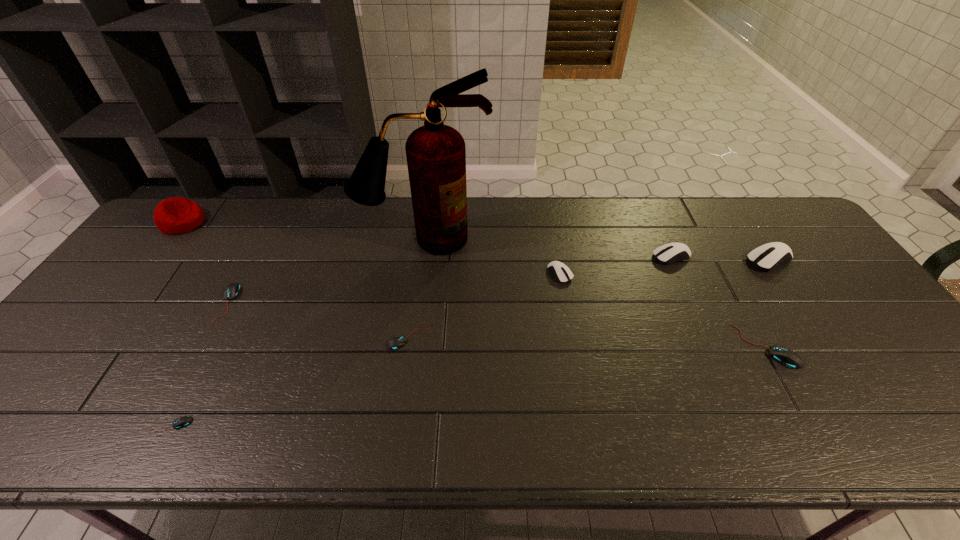
You are a GUI agent. You are given a task and a screenshot of the screen. Output one action in this format:
    pyautogui.click(x=<x>, y=<y>)
    Task: Click on the object at the left edge
    This screenshot has width=960, height=540.
    Given the screenshot: What is the action you would take?
    pyautogui.click(x=176, y=215)

You are a GUI agent. You are given a task and a screenshot of the screen. Output one action in this format:
    pyautogui.click(x=<x>, y=<y>)
    Task: Click on the object that is at the right edge
    The height and width of the screenshot is (540, 960).
    Given the screenshot: What is the action you would take?
    pyautogui.click(x=765, y=257)

Locate an element on the screen. The image size is (960, 540). object that is at the far left corner is located at coordinates (176, 215).

Identify the location of vacant space at the far edge of the desktop. (574, 231).

In order to click on vacant space at the near edge of the desktop in this screenshot , I will do `click(548, 432)`.

In the image, there is a desktop. In order to click on vacant space at the right edge in this screenshot , I will do `click(828, 327)`.

Locate an element on the screen. The width and height of the screenshot is (960, 540). free area in between the rightmost mouse and the sixth shortest mouse is located at coordinates (721, 259).

The height and width of the screenshot is (540, 960). What are the coordinates of `free area in between the red fire extinguisher and the fifth shortest object` in the screenshot? It's located at (492, 256).

What are the coordinates of `vacant space that is in between the leftmost object and the tallest object` in the screenshot? It's located at (303, 231).

Locate an element on the screen. The image size is (960, 540). free space between the sixth shortest object and the shortest object is located at coordinates (421, 341).